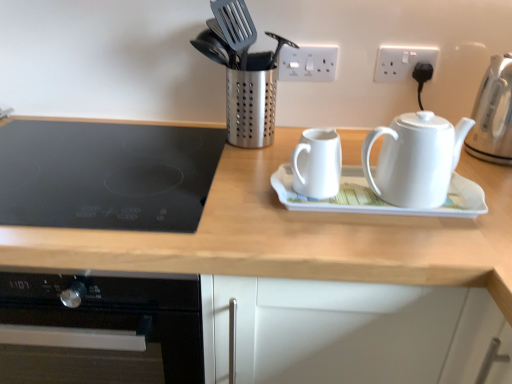
Question: From a real-world perspective, is white plastic socket at upper center, which appears as the second electric outlet when viewed from the right, physically located above or below wooden at upper center?

Choices:
 (A) below
 (B) above

Answer: (B)

Question: In terms of height, does white plastic socket at upper center, which appears as the second electric outlet when viewed from the right, look taller or shorter compared to wooden at upper center?

Choices:
 (A) short
 (B) tall

Answer: (A)

Question: Which object is the closest to the white glossy teapot at center, arranged as the first kettle when viewed from the left?

Choices:
 (A) wooden at upper center
 (B) white ceramic saucer at center
 (C) black glass cooktop at left
 (D) white plastic socket at upper center, the first electric outlet in the left-to-right sequence
 (E) white plastic electric outlet at upper right, the 2th electric outlet when ordered from left to right

Answer: (B)

Question: Estimate the real-world distances between objects in this image. Which object is farther from the white plastic electric outlet at upper right, the 2th electric outlet when ordered from left to right?

Choices:
 (A) wooden at upper center
 (B) white ceramic saucer at center
 (C) white plastic socket at upper center, the first electric outlet in the left-to-right sequence
 (D) white glossy teapot at right, which appears as the second kettle when viewed from the right
 (E) black glass cooktop at left

Answer: (E)